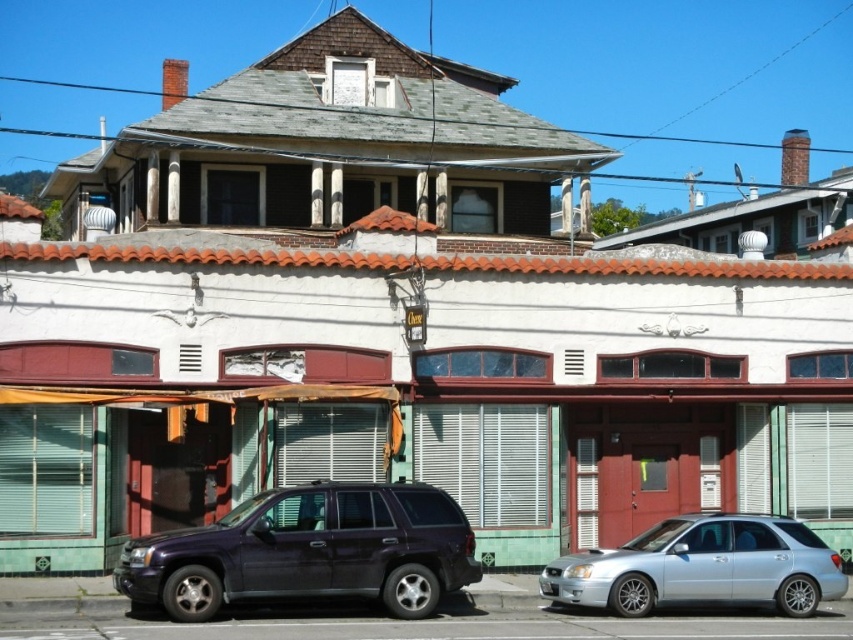
You are a delivery person trying to park your van between the glossy dark blue suv at center and the silver metallic sedan at lower right. Can you park your van there if your van is 2 meters wide?

The glossy dark blue suv at center is in front of the silver metallic sedan at lower right, but the distance between them isn not specified. Without knowing the space between the two vehicles, it is impossible to determine if the van can fit.

You are a delivery person who needs to park your van between the glossy dark blue suv at center and the silver metallic sedan at lower right. Your van is 8 feet long. Can you fit your van between them without moving either vehicle?

The distance between the glossy dark blue suv at center and the silver metallic sedan at lower right is 9.71 feet. Since your van is 8 feet long, it can fit between them as there is enough space.

You are a delivery person who needs to park your truck behind the glossy dark blue suv at center and the silver metallic sedan at lower right. Given that your truck is 2 meters tall, can you determine if there is enough vertical clearance between the two vehicles to park your truck?

The glossy dark blue suv at center is much taller than the silver metallic sedan at lower right. Since the SUV is taller, the vertical clearance between them would depend on the height of the SUV. If the SUV is taller than 2 meters, then there might be enough space, but if it is shorter, it might not. However, the description only states the SUV is taller than the sedan, not its exact height. Without knowing the SUVs exact height, we cannot definitively determine if the truck can park there.